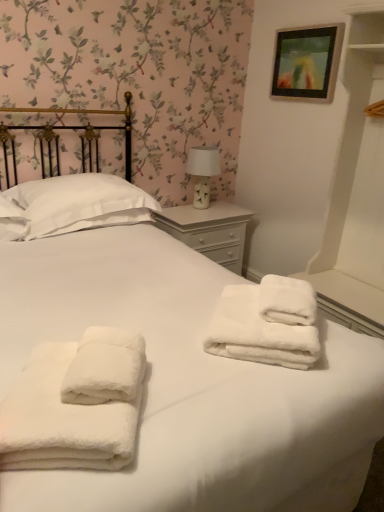
Question: From a real-world perspective, is white soft pillow at upper left positioned above or below wooden picture frame at upper right?

Choices:
 (A) below
 (B) above

Answer: (A)

Question: Is white soft pillow at upper left inside the boundaries of wooden picture frame at upper right, or outside?

Choices:
 (A) inside
 (B) outside

Answer: (B)

Question: Which object is positioned farthest from the wooden picture frame at upper right?

Choices:
 (A) white soft pillow at upper left
 (B) white fluffy towels at center, the 1th towel when ordered from front to back
 (C) white painted wood nightstand at center
 (D) white ceramic table lamp at upper right
 (E) white fluffy towels at center, arranged as the 2th towel when viewed from the left

Answer: (B)

Question: Which object is positioned closest to the white fluffy towels at center, the 1th towel when ordered from front to back?

Choices:
 (A) white soft pillow at upper left
 (B) white fluffy towels at center, the 1th towel in the back-to-front sequence
 (C) white painted wood nightstand at center
 (D) wooden picture frame at upper right
 (E) white ceramic table lamp at upper right

Answer: (B)